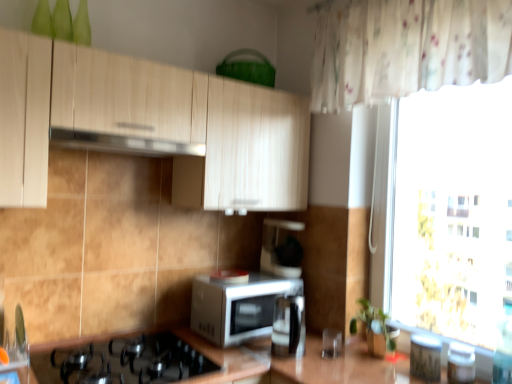
Question: Could you tell me if white sheer curtain at right is turned towards satin silver exhaust hood at upper center?

Choices:
 (A) yes
 (B) no

Answer: (B)

Question: From a real-world perspective, does white sheer curtain at right stand above satin silver exhaust hood at upper center?

Choices:
 (A) yes
 (B) no

Answer: (B)

Question: Is white sheer curtain at right directly adjacent to satin silver exhaust hood at upper center?

Choices:
 (A) no
 (B) yes

Answer: (A)

Question: Does white sheer curtain at right have a greater width compared to satin silver exhaust hood at upper center?

Choices:
 (A) yes
 (B) no

Answer: (B)

Question: Does white sheer curtain at right come in front of satin silver exhaust hood at upper center?

Choices:
 (A) no
 (B) yes

Answer: (A)

Question: Considering the positions of metallic silver toaster at lower right, which appears as the second appliance when viewed from the left, and satin silver kettle at center, which is counted as the first appliance, starting from the left, in the image, is metallic silver toaster at lower right, which appears as the second appliance when viewed from the left, wider or thinner than satin silver kettle at center, which is counted as the first appliance, starting from the left,?

Choices:
 (A) wide
 (B) thin

Answer: (B)

Question: Choose the correct answer: Is metallic silver toaster at lower right, which appears as the second appliance when viewed from the left, inside satin silver kettle at center, which is counted as the first appliance, starting from the left, or outside it?

Choices:
 (A) outside
 (B) inside

Answer: (A)

Question: Relative to satin silver kettle at center, which is counted as the first appliance, starting from the left, is metallic silver toaster at lower right, which is the 2th appliance from right to left, in front or behind?

Choices:
 (A) behind
 (B) front

Answer: (B)

Question: From the image's perspective, relative to satin silver kettle at center, which is the 3th appliance from right to left, is metallic silver toaster at lower right, which is the 2th appliance from right to left, above or below?

Choices:
 (A) below
 (B) above

Answer: (A)

Question: Is white glossy microwave at center taller or shorter than black matte gas stove at lower left?

Choices:
 (A) short
 (B) tall

Answer: (B)

Question: From a real-world perspective, is white glossy microwave at center positioned above or below black matte gas stove at lower left?

Choices:
 (A) below
 (B) above

Answer: (B)

Question: Is white glossy microwave at center wider or thinner than black matte gas stove at lower left?

Choices:
 (A) thin
 (B) wide

Answer: (A)

Question: Does point (260, 309) appear closer or farther from the camera than point (73, 357)?

Choices:
 (A) closer
 (B) farther

Answer: (B)

Question: From a real-world perspective, relative to white glossy microwave at center, is white sheer curtain at right vertically above or below?

Choices:
 (A) below
 (B) above

Answer: (B)

Question: From the image's perspective, is white sheer curtain at right above or below white glossy microwave at center?

Choices:
 (A) above
 (B) below

Answer: (A)